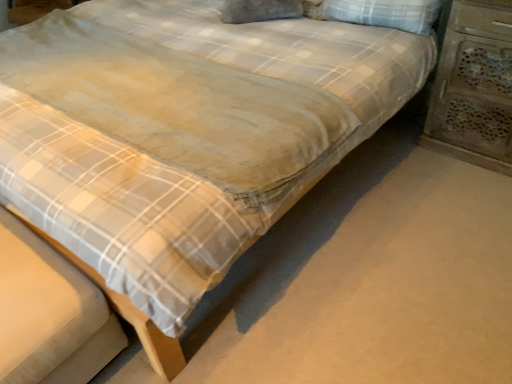
Question: Is wooden carved nightstand at right smaller than white checkered pillow at upper right?

Choices:
 (A) yes
 (B) no

Answer: (B)

Question: From the image's perspective, is wooden carved nightstand at right below white checkered pillow at upper right?

Choices:
 (A) no
 (B) yes

Answer: (B)

Question: Is wooden carved nightstand at right completely or partially outside of white checkered pillow at upper right?

Choices:
 (A) yes
 (B) no

Answer: (A)

Question: From a real-world perspective, is wooden carved nightstand at right located higher than white checkered pillow at upper right?

Choices:
 (A) yes
 (B) no

Answer: (B)

Question: Is wooden carved nightstand at right to the right of white checkered pillow at upper right from the viewer's perspective?

Choices:
 (A) yes
 (B) no

Answer: (A)

Question: Is wooden carved nightstand at right surrounding white checkered pillow at upper right?

Choices:
 (A) no
 (B) yes

Answer: (A)

Question: Is white checkered pillow at upper right outside wooden carved nightstand at right?

Choices:
 (A) yes
 (B) no

Answer: (A)

Question: Considering the relative sizes of white checkered pillow at upper right and wooden carved nightstand at right in the image provided, is white checkered pillow at upper right shorter than wooden carved nightstand at right?

Choices:
 (A) yes
 (B) no

Answer: (A)

Question: From the image's perspective, would you say white checkered pillow at upper right is positioned over wooden carved nightstand at right?

Choices:
 (A) no
 (B) yes

Answer: (B)

Question: Would you say wooden carved nightstand at right is part of white checkered pillow at upper right's contents?

Choices:
 (A) yes
 (B) no

Answer: (B)

Question: Is white checkered pillow at upper right to the right of wooden carved nightstand at right from the viewer's perspective?

Choices:
 (A) yes
 (B) no

Answer: (B)

Question: Is white checkered pillow at upper right facing towards wooden carved nightstand at right?

Choices:
 (A) no
 (B) yes

Answer: (A)

Question: Would you say white checkered pillow at upper right is inside or outside wooden carved nightstand at right?

Choices:
 (A) inside
 (B) outside

Answer: (B)